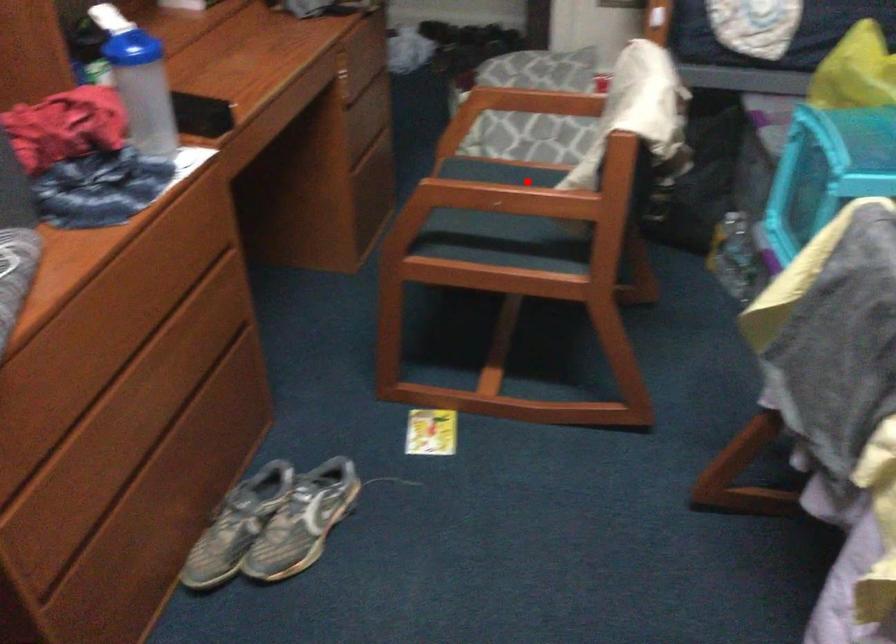
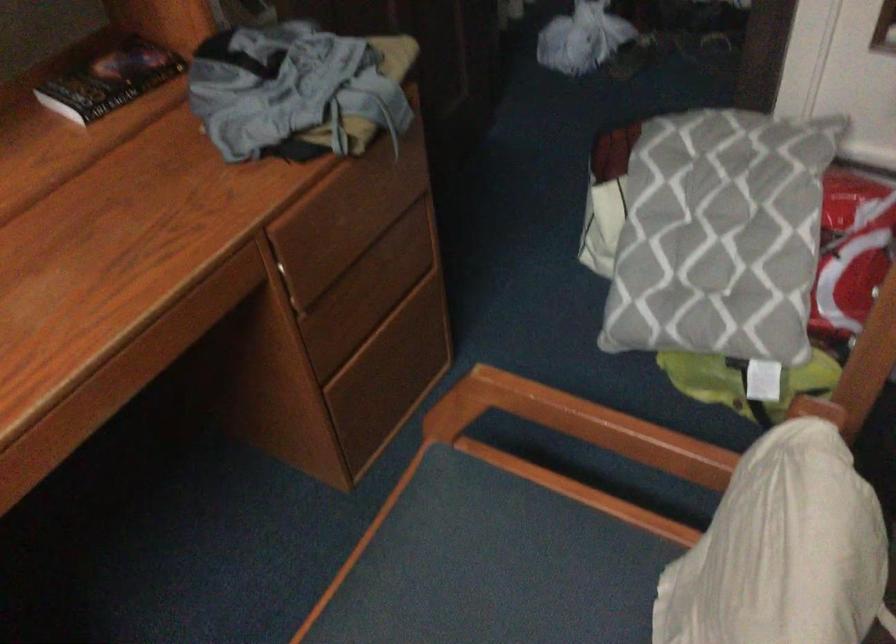
Question: I am providing you with two images of the same scene from different viewpoints. Image1 has a red point marked. In image2, the corresponding 3D location appears at what relative position? Reply with the corresponding letter.

Choices:
 (A) Closer
 (B) Farther

Answer: (A)